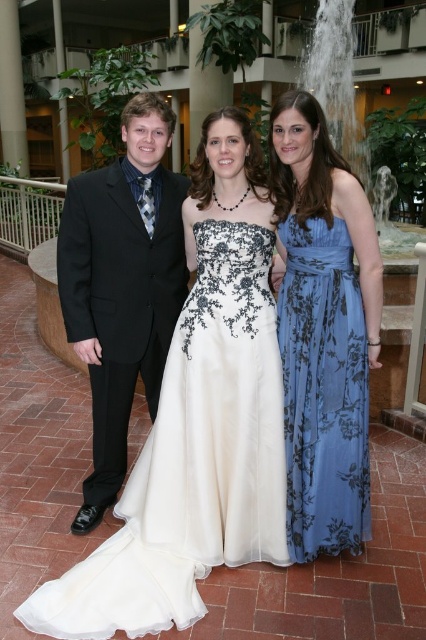
You are a photographer at this event and need to ensure all guests fit within the frame. The ivory satin dress at center and the blue floral dress at center are both in the center. Which dress takes up more space in the photo?

The ivory satin dress at center is larger in size than the blue floral dress at center, so it takes up more space in the photo.

You are a photographer at this event and need to adjust the lighting between the blue floral dress at center and the black satin suit at center. The minimum distance required for your equipment to function properly is 30 inches. Based on the scene, will your equipment work effectively between these two objects?

The blue floral dress at center is 31.76 inches away from the black satin suit at center. Since the minimum required distance is 30 inches, the equipment will work effectively between them.

You are standing at the point marked by coordinates point (324,330) in the image. Which object are you standing on?

You are standing on the blue floral dress at center.